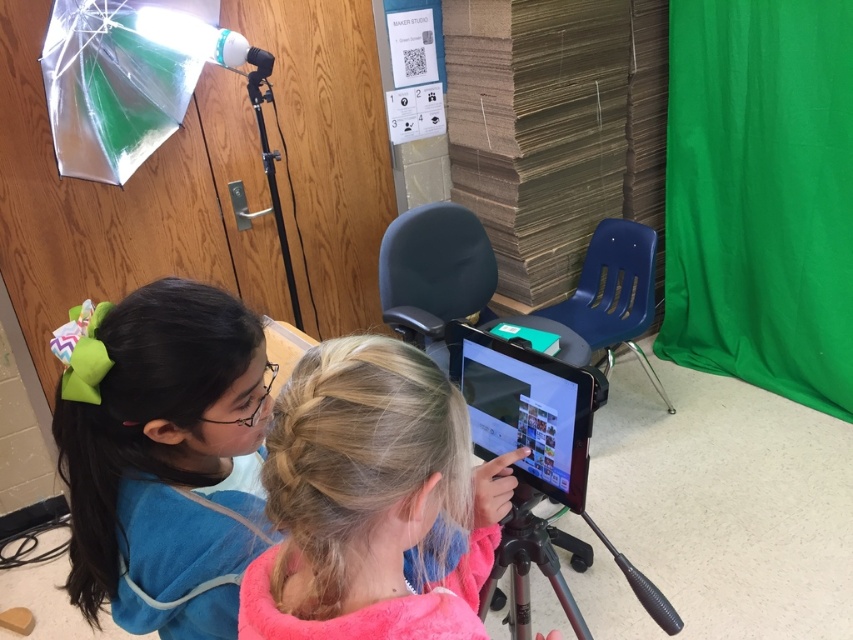
Question: Which of the following is the farthest from the observer?

Choices:
 (A) shiny black tablet at center
 (B) pink fleece jacket at center

Answer: (A)

Question: Considering the relative positions of pink fleece jacket at center and metallic tripod at center in the image provided, where is pink fleece jacket at center located with respect to metallic tripod at center?

Choices:
 (A) left
 (B) right

Answer: (A)

Question: Is shiny black tablet at center wider than matte black chair at center?

Choices:
 (A) yes
 (B) no

Answer: (B)

Question: Is transparent plastic umbrella at upper left above metallic tripod at center?

Choices:
 (A) yes
 (B) no

Answer: (A)

Question: Which point is closer to the camera?

Choices:
 (A) pink fleece jacket at center
 (B) matte blue shirt at left
 (C) matte black chair at center

Answer: (A)

Question: Which object is positioned farthest from the transparent plastic umbrella at upper left?

Choices:
 (A) matte blue shirt at left
 (B) matte black chair at center
 (C) metallic tripod at center
 (D) pink fleece jacket at center

Answer: (D)